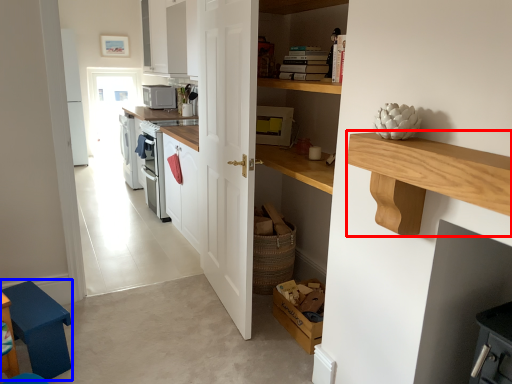
Question: Which of the following is the farthest to the observer, counter (highlighted by a red box) or step stool (highlighted by a blue box)?

Choices:
 (A) counter
 (B) step stool

Answer: (B)